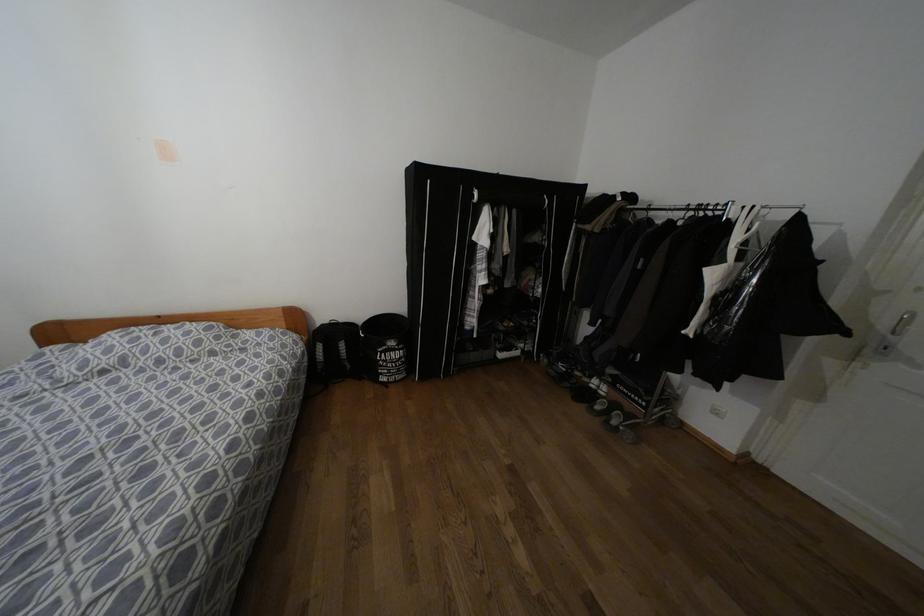
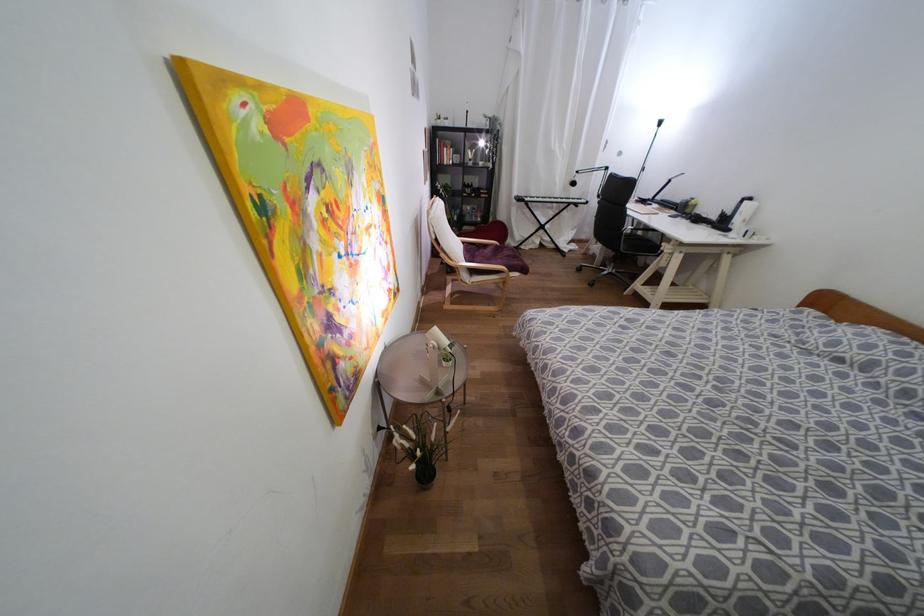
First-person continuous shooting, in which direction is the camera rotating?

The camera's rotation is toward left-down.